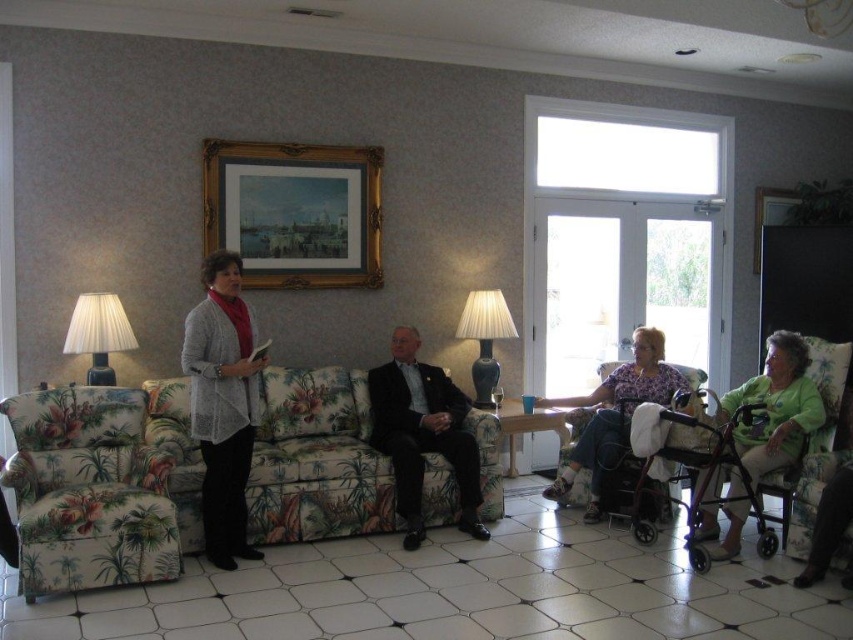
Question: Is green cotton shirt at lower right above matte ceramic lamp at center?

Choices:
 (A) yes
 (B) no

Answer: (B)

Question: Is floral fabric couch at center behind wooden picture frame at upper right?

Choices:
 (A) yes
 (B) no

Answer: (B)

Question: Which point is closer to the camera?

Choices:
 (A) (140, 497)
 (B) (836, 449)

Answer: (A)

Question: Is gray knitted sweater at center below matte ceramic lamp at center?

Choices:
 (A) yes
 (B) no

Answer: (A)

Question: Which of the following is the farthest from the observer?

Choices:
 (A) (758, 248)
 (B) (93, 320)
 (C) (161, 433)
 (D) (579, 467)

Answer: (A)

Question: Which of the following is the closest to the observer?

Choices:
 (A) (746, 488)
 (B) (807, 564)
 (C) (490, 369)
 (D) (94, 317)

Answer: (B)